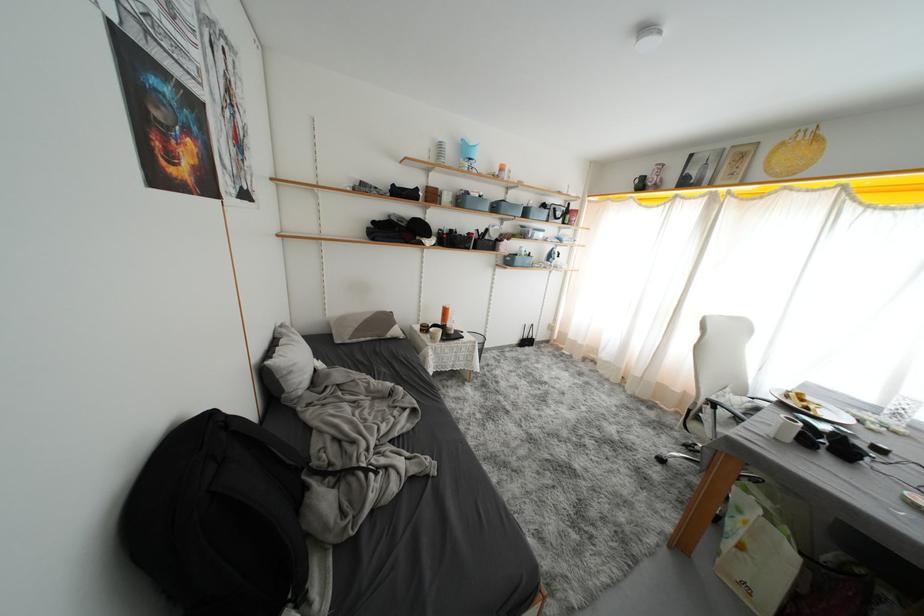
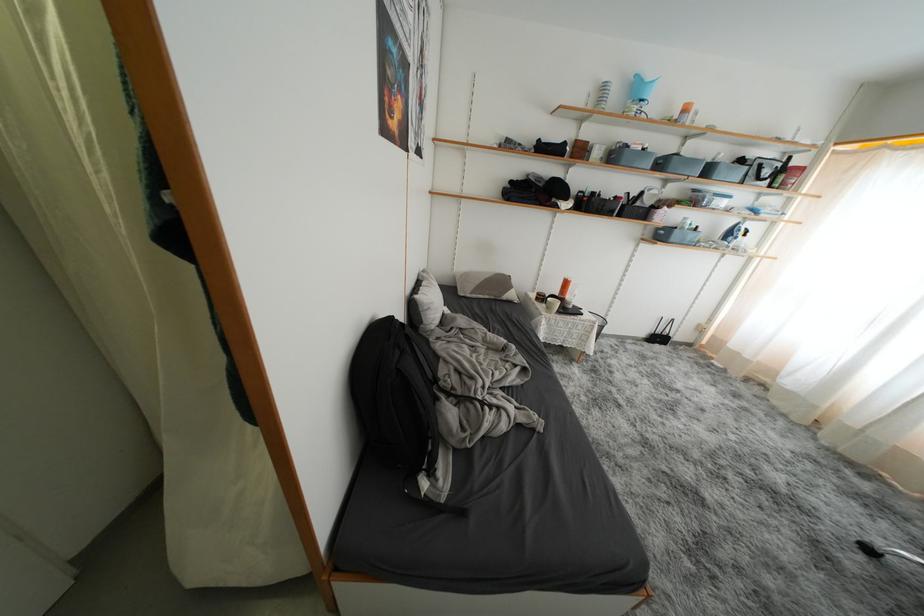
In the second image, find the point that corresponds to point 457,198 in the first image.

(610, 152)